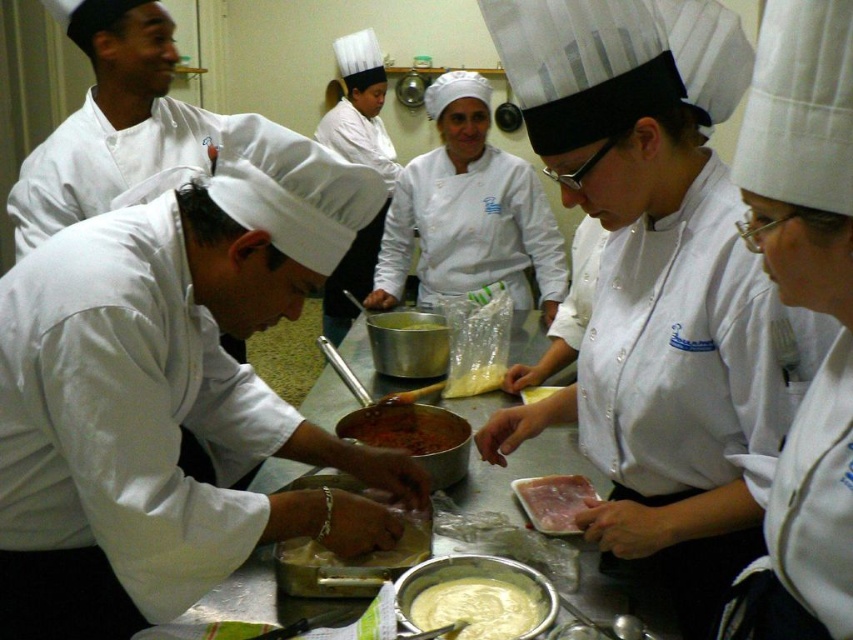
Who is taller, thick red sauce at center or white glossy meat at center?

thick red sauce at center is taller.

This screenshot has height=640, width=853. What do you see at coordinates (405, 428) in the screenshot?
I see `thick red sauce at center` at bounding box center [405, 428].

Between point (422, 440) and point (585, 481), which one is positioned in front?

Point (585, 481) is more forward.

This screenshot has width=853, height=640. I want to click on thick red sauce at center, so click(x=405, y=428).

Is white creamy sauce at center smaller than white creamy dough at center?

Correct, white creamy sauce at center occupies less space than white creamy dough at center.

Who is taller, white creamy sauce at center or white creamy dough at center?

With more height is white creamy dough at center.

Which is in front, point (541, 616) or point (428, 536)?

Positioned in front is point (541, 616).

Locate an element on the screen. Image resolution: width=853 pixels, height=640 pixels. white creamy sauce at center is located at coordinates (477, 609).

Can you confirm if white glossy chef coat at center is positioned to the left of white creamy dough at center?

No, white glossy chef coat at center is not to the left of white creamy dough at center.

Is the position of white glossy chef coat at center less distant than that of white creamy dough at center?

That is True.

Does point (727, 49) lie behind point (392, 554)?

No.

Image resolution: width=853 pixels, height=640 pixels. I want to click on white glossy chef coat at center, so click(659, 284).